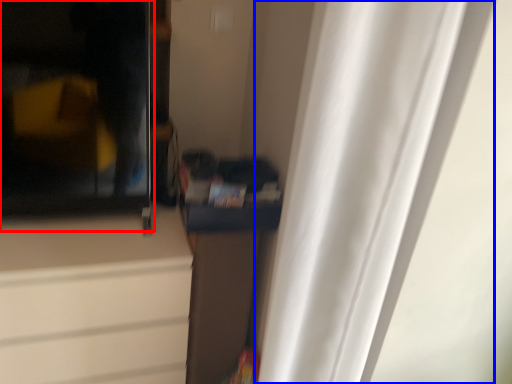
Question: Which of the following is the closest to the observer, screen door (highlighted by a red box) or curtain (highlighted by a blue box)?

Choices:
 (A) screen door
 (B) curtain

Answer: (B)